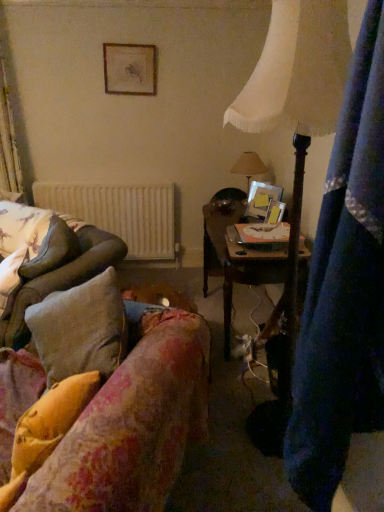
You are a GUI agent. You are given a task and a screenshot of the screen. Output one action in this format:
    pyautogui.click(x=<x>, y=<y>)
    Task: Click on the white matte radiator at upper left
    This screenshot has width=384, height=512.
    Given the screenshot: What is the action you would take?
    pyautogui.click(x=119, y=213)

The height and width of the screenshot is (512, 384). What do you see at coordinates (119, 213) in the screenshot?
I see `white matte radiator at upper left` at bounding box center [119, 213].

What do you see at coordinates (294, 138) in the screenshot? The height and width of the screenshot is (512, 384). I see `white fabric lampshade at upper right` at bounding box center [294, 138].

In order to face beige fabric lampshade at upper center, should I rotate leftwards or rightwards?

Rotate right and turn 7.659 degrees.

Measure the distance between point (271, 203) and camera.

Point (271, 203) and camera are 2.65 meters apart.

Describe the element at coordinates (275, 212) in the screenshot. I see `wooden picture frame at center, marked as the third picture frame in a back-to-front arrangement` at that location.

What do you see at coordinates (133, 426) in the screenshot?
I see `fluffy fabric couch at lower left` at bounding box center [133, 426].

Locate an element on the screen. fluffy yellow pillow at lower left, acting as the 1th pillow starting from the bottom is located at coordinates (50, 421).

What are the coordinates of `fluffy beige pillow at left, arranged as the first pillow when viewed from the back` in the screenshot? It's located at (52, 250).

Where is `white matte radiator at upper left`? The height and width of the screenshot is (512, 384). white matte radiator at upper left is located at coordinates (119, 213).

Is white matte radiator at upper left turned away from white fabric lampshade at upper right?

No, white matte radiator at upper left is not facing the opposite direction of white fabric lampshade at upper right.

I want to click on lamp in front of the white matte radiator at upper left, so click(x=294, y=138).

Would you consider white matte radiator at upper left to be distant from white fabric lampshade at upper right?

white matte radiator at upper left is positioned a significant distance from white fabric lampshade at upper right.

Based on the photo, is white matte radiator at upper left wider or thinner than white fabric lampshade at upper right?

Considering their sizes, white matte radiator at upper left looks slimmer than white fabric lampshade at upper right.

Is wooden picture frame at upper center, arranged as the third picture frame when viewed from the right, positioned with its back to white matte radiator at upper left?

wooden picture frame at upper center, arranged as the third picture frame when viewed from the right, does not have its back to white matte radiator at upper left.

From a real-world perspective, between wooden picture frame at upper center, arranged as the third picture frame when viewed from the right, and white matte radiator at upper left, who is vertically higher?

From a 3D spatial view, wooden picture frame at upper center, arranged as the third picture frame when viewed from the right, is above.

Considering the sizes of objects wooden picture frame at upper center, which is counted as the 1th picture frame, starting from the left, and white matte radiator at upper left in the image provided, who is bigger, wooden picture frame at upper center, which is counted as the 1th picture frame, starting from the left, or white matte radiator at upper left?

With larger size is white matte radiator at upper left.

Would you say wooden picture frame at upper center, the third picture frame from the front, is outside white matte radiator at upper left?

Yes, wooden picture frame at upper center, the third picture frame from the front, is located beyond the bounds of white matte radiator at upper left.

Is fluffy beige pillow at left, the first pillow when ordered from left to right, at the right side of wooden picture frame at upper center, the 3th picture frame ordered from the bottom?

No, fluffy beige pillow at left, the first pillow when ordered from left to right, is not to the right of wooden picture frame at upper center, the 3th picture frame ordered from the bottom.

Choose the correct answer: Is fluffy beige pillow at left, the first pillow when ordered from left to right, inside wooden picture frame at upper center, arranged as the third picture frame when viewed from the right, or outside it?

fluffy beige pillow at left, the first pillow when ordered from left to right, is not inside wooden picture frame at upper center, arranged as the third picture frame when viewed from the right, it's outside.

Is fluffy beige pillow at left, the second pillow when ordered from front to back, aimed at wooden picture frame at upper center, the 3th picture frame ordered from the bottom?

No, fluffy beige pillow at left, the second pillow when ordered from front to back, is not aimed at wooden picture frame at upper center, the 3th picture frame ordered from the bottom.

Could you measure the distance between fluffy beige pillow at left, the second pillow when ordered from front to back, and wooden picture frame at upper center, arranged as the 1th picture frame when viewed from the top?

fluffy beige pillow at left, the second pillow when ordered from front to back, and wooden picture frame at upper center, arranged as the 1th picture frame when viewed from the top, are 1.50 meters apart.

Is fluffy fabric couch at lower left next to beige fabric lampshade at upper center?

No, fluffy fabric couch at lower left is not with beige fabric lampshade at upper center.

Considering the relative sizes of fluffy fabric couch at lower left and beige fabric lampshade at upper center in the image provided, is fluffy fabric couch at lower left taller than beige fabric lampshade at upper center?

Yes, fluffy fabric couch at lower left is taller than beige fabric lampshade at upper center.

Looking at this image, measure the distance between fluffy fabric couch at lower left and beige fabric lampshade at upper center.

fluffy fabric couch at lower left and beige fabric lampshade at upper center are 2.00 meters apart.

The height and width of the screenshot is (512, 384). In order to click on table lamp above the fluffy fabric couch at lower left (from the image's perspective) in this screenshot , I will do `click(249, 166)`.

Considering the relative sizes of fluffy fabric couch at lower left and wooden picture frame at upper center, the third picture frame from the front, in the image provided, is fluffy fabric couch at lower left thinner than wooden picture frame at upper center, the third picture frame from the front,?

In fact, fluffy fabric couch at lower left might be wider than wooden picture frame at upper center, the third picture frame from the front.

In the scene shown: Is fluffy fabric couch at lower left facing away from wooden picture frame at upper center, acting as the first picture frame starting from the back?

fluffy fabric couch at lower left does not have its back to wooden picture frame at upper center, acting as the first picture frame starting from the back.

Which of these two, fluffy fabric couch at lower left or wooden picture frame at upper center, which is counted as the 1th picture frame, starting from the left, stands shorter?

Standing shorter between the two is wooden picture frame at upper center, which is counted as the 1th picture frame, starting from the left.

From a real-world perspective, is fluffy beige pillow at left, which is counted as the second pillow, starting from the right, positioned over white fabric lampshade at upper right based on gravity?

No, from a real-world perspective, fluffy beige pillow at left, which is counted as the second pillow, starting from the right, is not on top of white fabric lampshade at upper right.

From the picture: In terms of size, does fluffy beige pillow at left, the 2th pillow positioned from the bottom, appear bigger or smaller than white fabric lampshade at upper right?

Clearly, fluffy beige pillow at left, the 2th pillow positioned from the bottom, is smaller in size than white fabric lampshade at upper right.

Would you say fluffy beige pillow at left, which is counted as the second pillow, starting from the right, is outside white fabric lampshade at upper right?

Yes.

Is fluffy beige pillow at left, the second pillow when ordered from front to back, at the right side of white fabric lampshade at upper right?

No.

Is fluffy yellow pillow at lower left, which is the 2th pillow in left-to-right order, positioned beyond the bounds of white matte radiator at upper left?

Yes, fluffy yellow pillow at lower left, which is the 2th pillow in left-to-right order, is outside of white matte radiator at upper left.

Are fluffy yellow pillow at lower left, which is the 2th pillow from back to front, and white matte radiator at upper left making contact?

No, fluffy yellow pillow at lower left, which is the 2th pillow from back to front, is not touching white matte radiator at upper left.

Is fluffy yellow pillow at lower left, which appears as the first pillow when viewed from the front, facing away from white matte radiator at upper left?

That's not correct — fluffy yellow pillow at lower left, which appears as the first pillow when viewed from the front, is not looking away from white matte radiator at upper left.

Find the location of `radiator on the left of white fabric lampshade at upper right`. radiator on the left of white fabric lampshade at upper right is located at coordinates (119, 213).

At what (x,y) coordinates should I click in order to perform the action: click on the 1st picture frame in front of the white matte radiator at upper left. Please return your answer as a coordinate pair (x, y). This screenshot has width=384, height=512. Looking at the image, I should click on (129, 69).

Considering their positions, is wooden picture frame at center, arranged as the 3th picture frame when viewed from the left, positioned closer to wooden desk at center than wooden picture frame at upper center, arranged as the third picture frame when viewed from the right?

wooden picture frame at center, arranged as the 3th picture frame when viewed from the left, is positioned closer to the anchor wooden desk at center.

Estimate the real-world distances between objects in this image. Which object is closer to beige fabric lampshade at upper center, fluffy fabric couch at lower left or white fabric lampshade at upper right?

white fabric lampshade at upper right.

Based on their spatial positions, is white matte radiator at upper left or beige fabric lampshade at upper center closer to white fabric lampshade at upper right?

beige fabric lampshade at upper center is positioned closer to the anchor white fabric lampshade at upper right.

When comparing their distances from white fabric lampshade at upper right, does beige fabric lampshade at upper center or fluffy yellow pillow at lower left, acting as the 1th pillow starting from the bottom, seem further?

beige fabric lampshade at upper center.

Which object lies further to the anchor point beige fabric lampshade at upper center, white fabric lampshade at upper right or wooden picture frame at center, which is the 1th picture frame from front to back?

Among the two, white fabric lampshade at upper right is located further to beige fabric lampshade at upper center.

Estimate the real-world distances between objects in this image. Which object is closer to wooden picture frame at center, placed as the 1th picture frame when sorted from right to left, white matte radiator at upper left or white fabric lampshade at upper right?

white fabric lampshade at upper right lies closer to wooden picture frame at center, placed as the 1th picture frame when sorted from right to left, than the other object.

Considering their positions, is fluffy beige pillow at left, which is the first pillow from top to bottom, positioned further to wooden desk at center than white fabric lampshade at upper right?

The object further to wooden desk at center is fluffy beige pillow at left, which is the first pillow from top to bottom.

Looking at the image, which one is located closer to white fabric lampshade at upper right, wooden picture frame at upper center, the third picture frame from the front, or white matte radiator at upper left?

Among the two, white matte radiator at upper left is located nearer to white fabric lampshade at upper right.

You are a GUI agent. You are given a task and a screenshot of the screen. Output one action in this format:
    pyautogui.click(x=<x>, y=<y>)
    Task: Click on the table between white matte radiator at upper left and wooden picture frame at center, arranged as the 3th picture frame when viewed from the left, from left to right
    
    Given the screenshot: What is the action you would take?
    pyautogui.click(x=236, y=260)

I want to click on table positioned between white fabric lampshade at upper right and white matte radiator at upper left from near to far, so click(236, 260).

Locate an element on the screen. This screenshot has width=384, height=512. pillow between fluffy fabric couch at lower left and wooden desk at center in the horizontal direction is located at coordinates (50, 421).

Identify the location of studio couch located between white fabric lampshade at upper right and wooden desk at center in the depth direction. (133, 426).